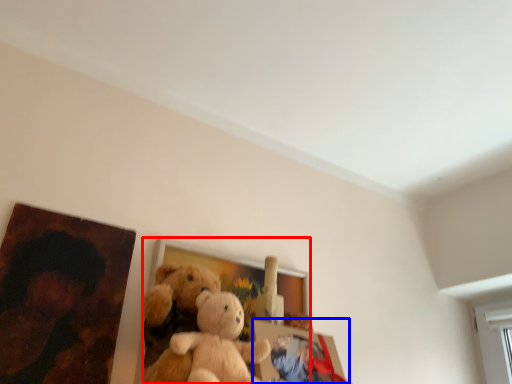
Question: Which point is closer to the camera, picture frame (highlighted by a red box) or picture frame (highlighted by a blue box)?

Choices:
 (A) picture frame
 (B) picture frame

Answer: (B)